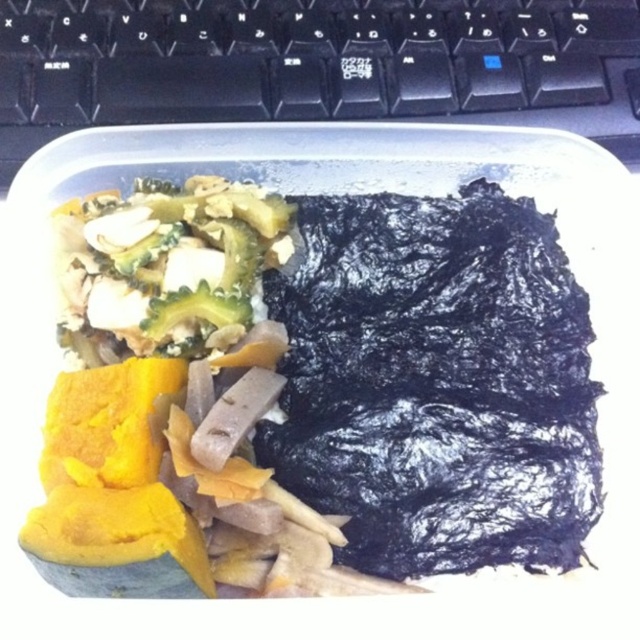
How far apart are the dark purple seaweed at upper right and the cooked vegetables on the left side of the container?

The dark purple seaweed at upper right and the cooked vegetables on the left side of the container are 32.82 inches apart.

Which object is located at the position marked by the point coordinates (x=316, y=397)?

The point coordinates (x=316, y=397) indicate the location of the dark purple seaweed at upper right.

Where is the dark purple seaweed at upper right located in the rectangular plastic container?

The dark purple seaweed at upper right is located at point (x=316, y=397) in the rectangular plastic container.